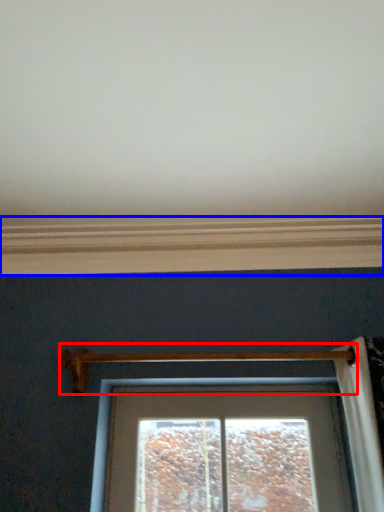
Question: Which point is further to the camera, door handle (highlighted by a red box) or window sill (highlighted by a blue box)?

Choices:
 (A) door handle
 (B) window sill

Answer: (B)